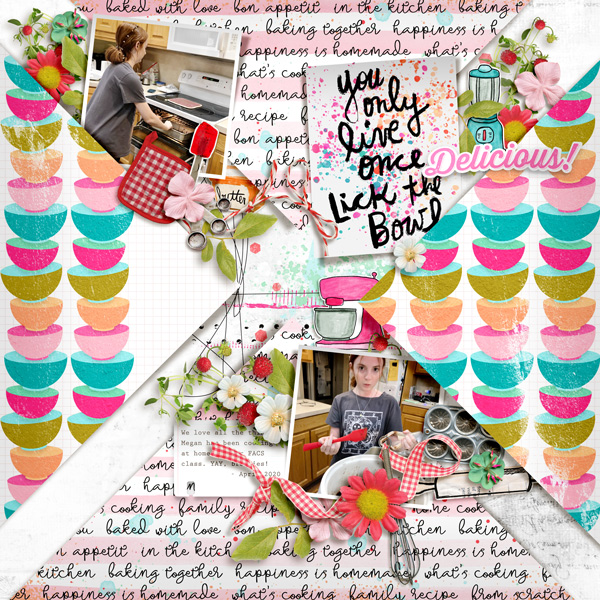
Locate an element on the screen. green bowls is located at coordinates (37, 432), (82, 427), (102, 286), (27, 288).